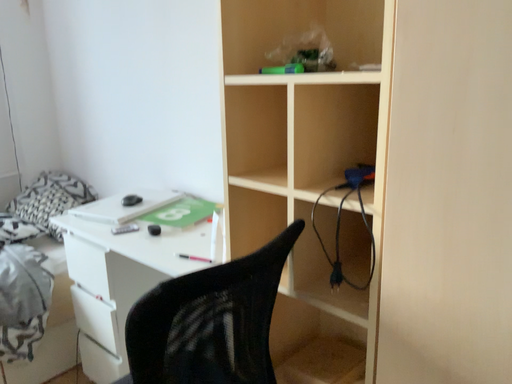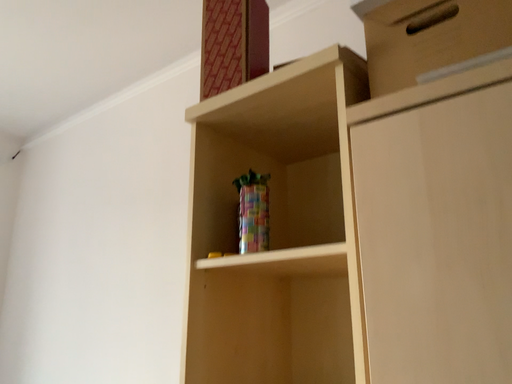
Question: Which way did the camera rotate in the video?

Choices:
 (A) rotated downward
 (B) rotated upward

Answer: (B)